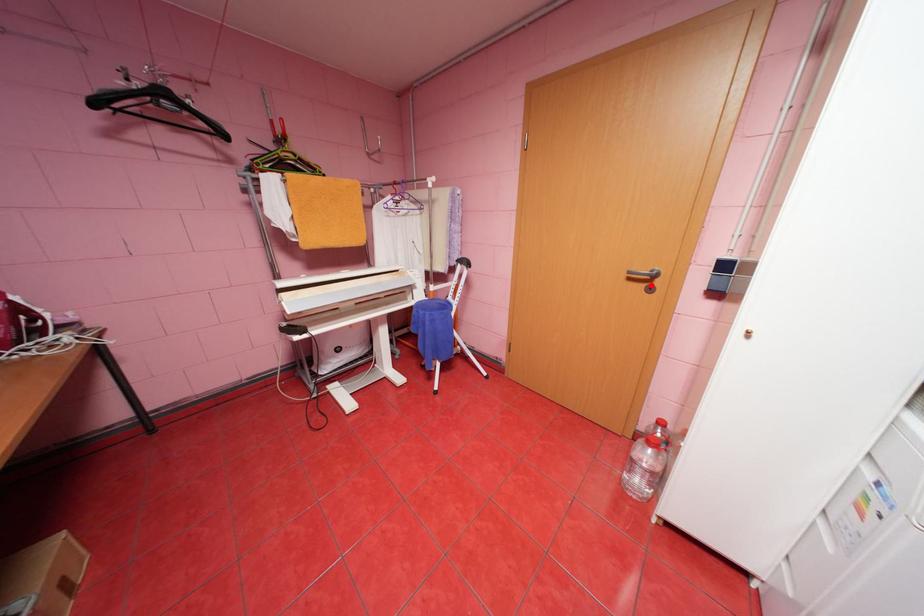
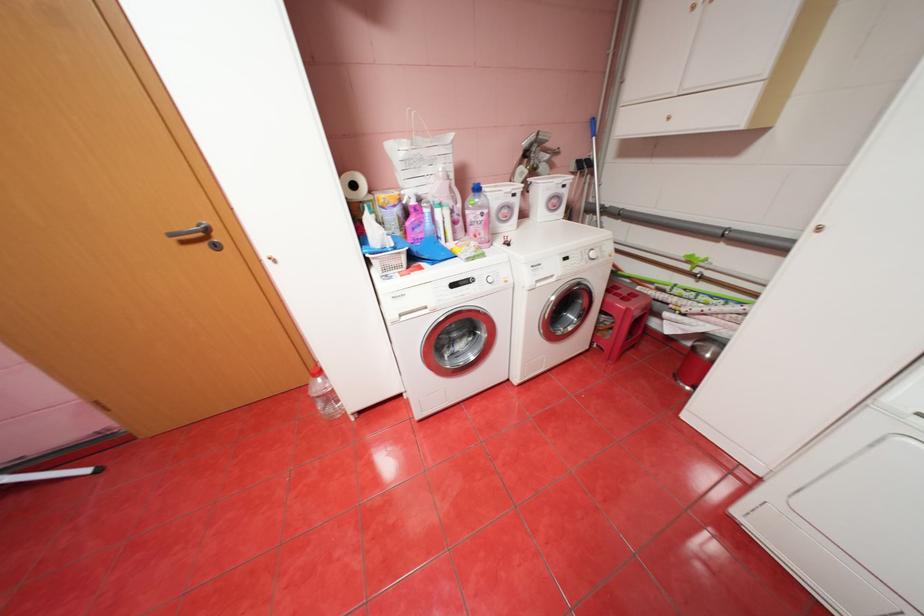
Where in the second image is the point corresponding to the highlighted location from the first image?

(213, 245)